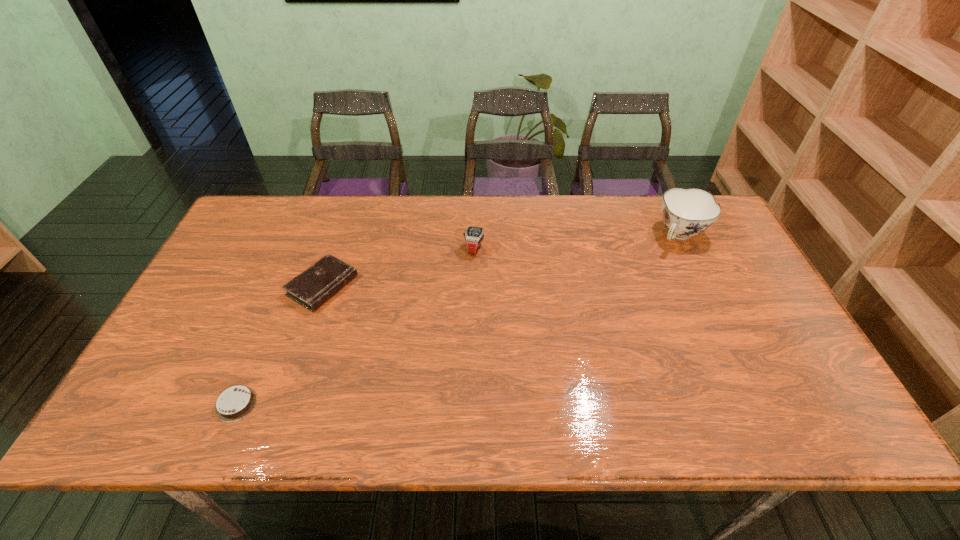
Locate an element on the screen. This screenshot has width=960, height=540. vacant space located on the back of the second nearest object is located at coordinates (341, 231).

This screenshot has height=540, width=960. I want to click on vacant space located on the left of the nearest object, so click(185, 404).

Where is `chinaware at the far edge`? chinaware at the far edge is located at coordinates [x=686, y=212].

The image size is (960, 540). I want to click on watch that is positioned at the far edge, so coord(474,236).

The width and height of the screenshot is (960, 540). In order to click on object that is at the near edge in this screenshot , I will do pos(235,403).

This screenshot has width=960, height=540. I want to click on object that is positioned at the right edge, so click(x=686, y=212).

The image size is (960, 540). Identify the location of object that is positioned at the far right corner. (686, 212).

You are a GUI agent. You are given a task and a screenshot of the screen. Output one action in this format:
    pyautogui.click(x=<x>, y=<y>)
    Task: Click on the vacant space at the far edge of the desktop
    This screenshot has width=960, height=540.
    Given the screenshot: What is the action you would take?
    pyautogui.click(x=534, y=203)

Where is `vacant point at the near edge`? vacant point at the near edge is located at coordinates (620, 416).

Locate an element on the screen. vacant space at the left edge is located at coordinates (268, 251).